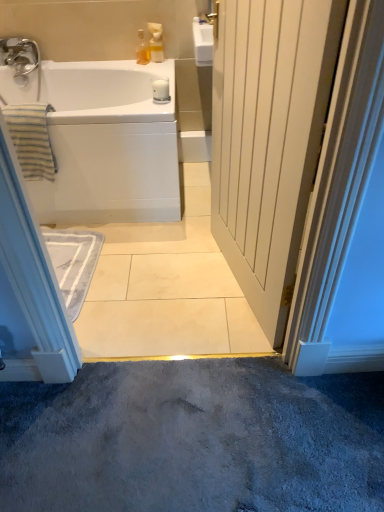
I want to click on free space to the left of translucent glass bottle at upper center, marked as the second toiletry in a right-to-left arrangement, so click(124, 64).